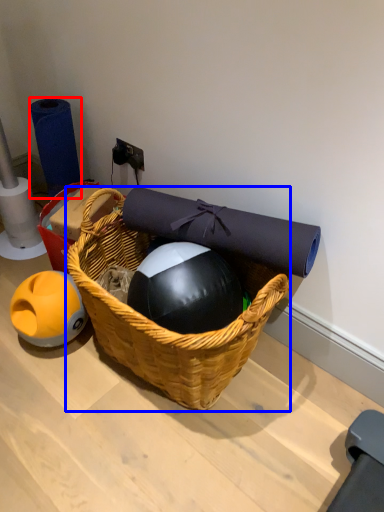
Question: Which of the following is the farthest to the observer, toilet paper (highlighted by a red box) or picnic basket (highlighted by a blue box)?

Choices:
 (A) toilet paper
 (B) picnic basket

Answer: (A)